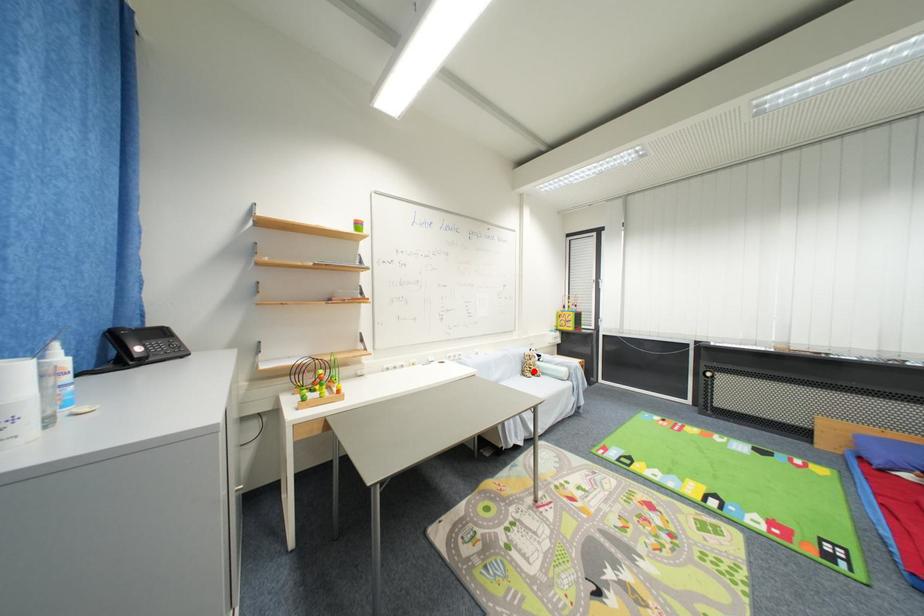
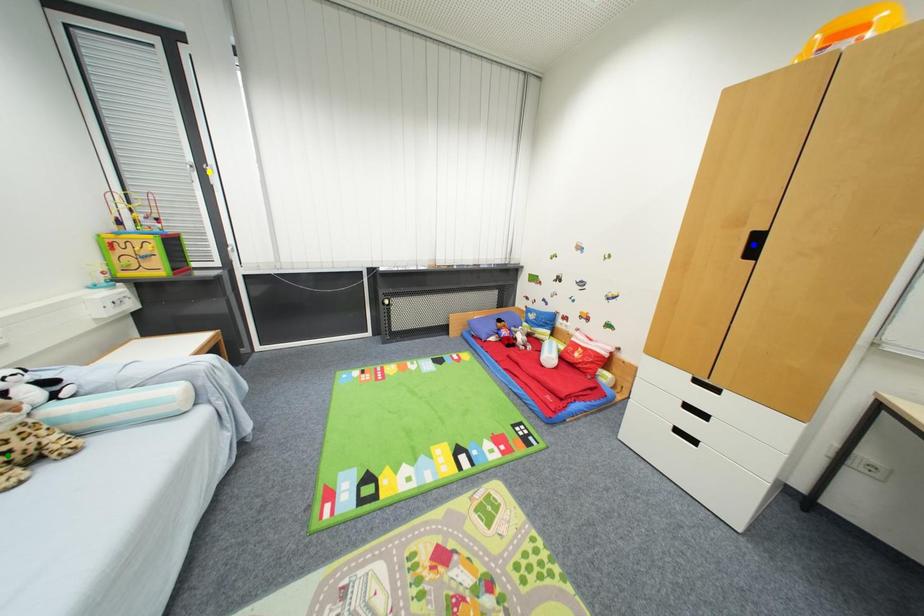
Question: I am providing you with two images of the same scene from different viewpoints. A red point is marked on the first image. You are given multiple points on the second image. Which mark in image 2 goes with the point in image 1?

Choices:
 (A) blue point
 (B) green point
 (C) yellow point

Answer: (B)